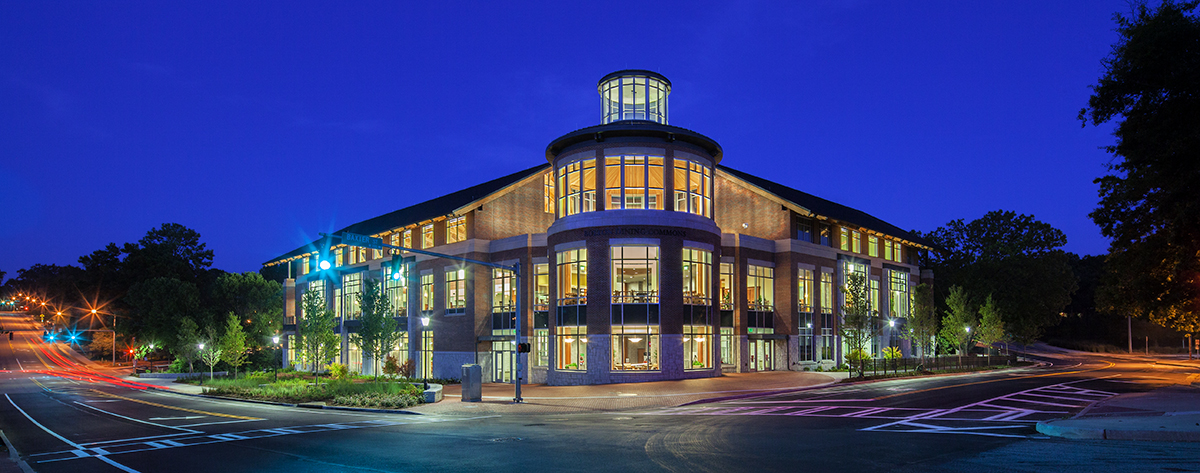
I want to click on door, so click(x=502, y=361), click(x=754, y=355).